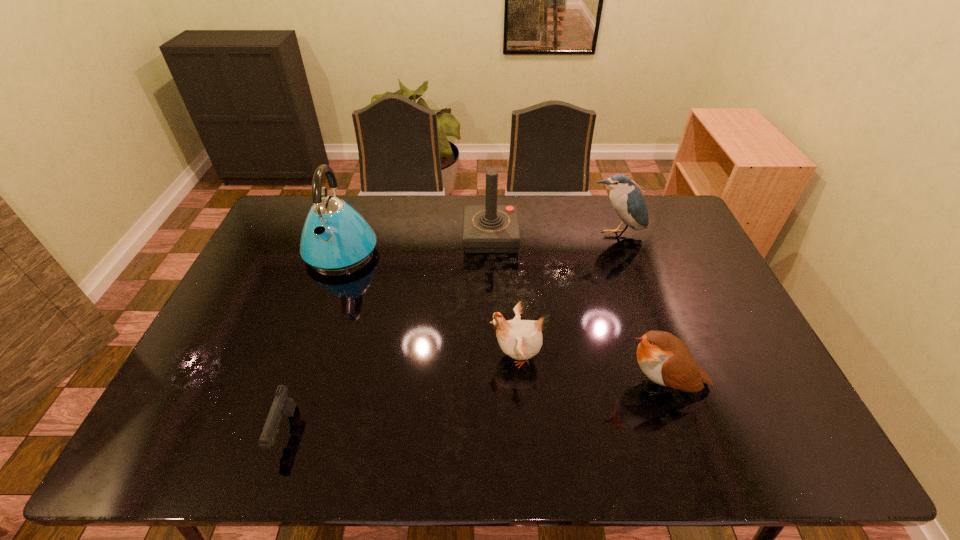
Where is `vacant space that satisfies the following two spatial constraints: 1. at the tip of the tallest bird's beak; 2. on the rectangular base of the joystick`? The image size is (960, 540). vacant space that satisfies the following two spatial constraints: 1. at the tip of the tallest bird's beak; 2. on the rectangular base of the joystick is located at coordinates (615, 238).